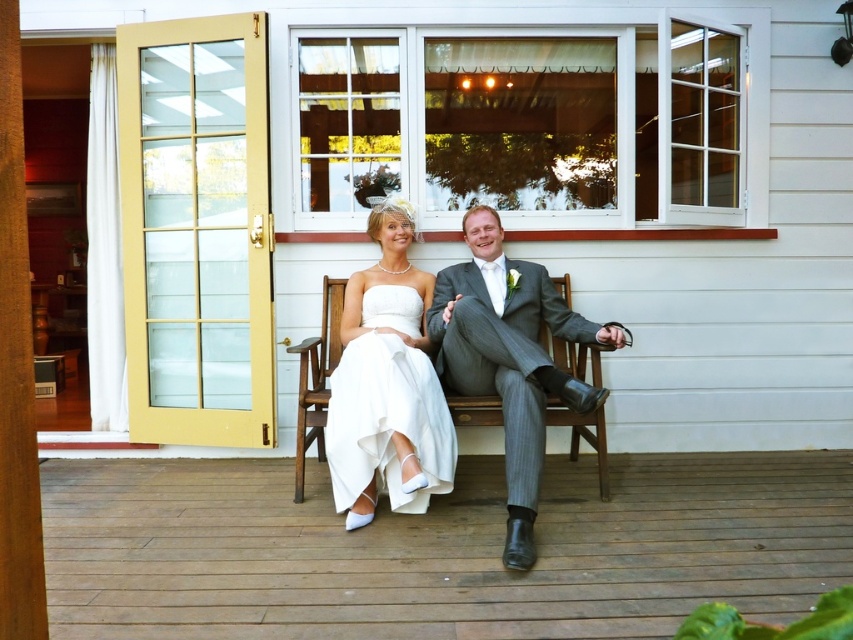
Who is positioned more to the left, white satin dress at center or gray striped suit at center?

Positioned to the left is white satin dress at center.

Does white satin dress at center have a larger size compared to gray striped suit at center?

Actually, white satin dress at center might be smaller than gray striped suit at center.

Does point (412, 220) lie in front of point (544, 410)?

That is False.

Identify the location of white satin dress at center. (387, 385).

Who is higher up, white satin dress at center or wooden bench at center?

white satin dress at center

At what (x,y) coordinates should I click in order to perform the action: click on white satin dress at center. Please return your answer as a coordinate pair (x, y). Looking at the image, I should click on (387, 385).

Is wooden floor at lower center smaller than white satin dress at center?

Actually, wooden floor at lower center might be larger than white satin dress at center.

Where is `wooden floor at lower center`? wooden floor at lower center is located at coordinates (439, 548).